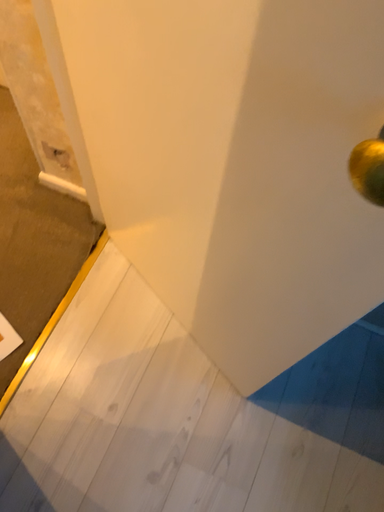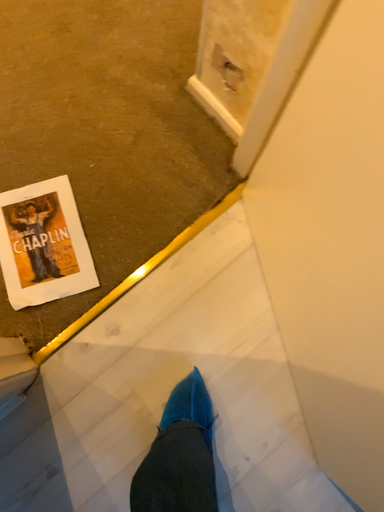
Question: Which way did the camera rotate in the video?

Choices:
 (A) rotated right
 (B) rotated left

Answer: (B)